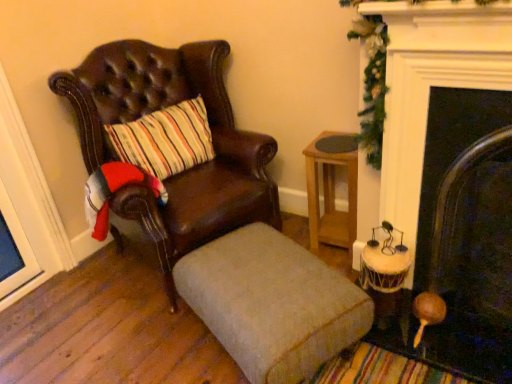
This screenshot has width=512, height=384. What are the coordinates of `beige fabric ottoman at center` in the screenshot? It's located at pyautogui.click(x=272, y=303).

Identify the location of leather chair at left. (181, 173).

From the picture: In order to face light brown wooden table at center-right, should I rotate leftwards or rightwards?

Rotate right and turn 11.432 degrees.

Where is `dark wood fireplace at right`? The width and height of the screenshot is (512, 384). dark wood fireplace at right is located at coordinates (469, 233).

I want to click on beige fabric ottoman at center, so click(x=272, y=303).

Is leather chair at left positioned in front of green garland at upper right?

No, leather chair at left is further to the viewer.

How many degrees apart are the facing directions of leather chair at left and green garland at upper right?

leather chair at left and green garland at upper right are facing 70.1 degrees away from each other.

Is leather chair at left with green garland at upper right?

No, leather chair at left is not beside green garland at upper right.

Is leather chair at left smaller than green garland at upper right?

No, leather chair at left is not smaller than green garland at upper right.

What's the angular difference between dark wood fireplace at right and green garland at upper right's facing directions?

There is a 1.19-degree angle between the facing directions of dark wood fireplace at right and green garland at upper right.

Does point (429, 186) come farther from viewer compared to point (367, 19)?

Yes, it is.

Is dark wood fireplace at right to the left of green garland at upper right from the viewer's perspective?

Incorrect, dark wood fireplace at right is not on the left side of green garland at upper right.

From a real-world perspective, who is located higher, dark wood fireplace at right or green garland at upper right?

green garland at upper right is physically above.

Is point (330, 300) positioned in front of point (102, 51)?

Yes, it is in front of point (102, 51).

Are beige fabric ottoman at center and leather chair at left making contact?

No, beige fabric ottoman at center is not in contact with leather chair at left.

Is dark wood fireplace at right located outside beige fabric ottoman at center?

Yes, dark wood fireplace at right is not within beige fabric ottoman at center.

In terms of size, does dark wood fireplace at right appear bigger or smaller than beige fabric ottoman at center?

dark wood fireplace at right is smaller than beige fabric ottoman at center.

From a real-world perspective, who is located lower, dark wood fireplace at right or beige fabric ottoman at center?

beige fabric ottoman at center.

In the image, there is a dark wood fireplace at right. At what (x,y) coordinates should I click in order to perform the action: click on the footrest below it (from the image's perspective). Please return your answer as a coordinate pair (x, y). Looking at the image, I should click on (272, 303).

Which of these two, light brown wooden table at center-right or green garland at upper right, is wider?

With larger width is light brown wooden table at center-right.

Can you confirm if light brown wooden table at center-right is shorter than green garland at upper right?

Correct, light brown wooden table at center-right is not as tall as green garland at upper right.

How much distance is there between light brown wooden table at center-right and green garland at upper right?

light brown wooden table at center-right is 17.04 inches away from green garland at upper right.

Is the depth of light brown wooden table at center-right greater than that of leather chair at left?

Yes.

In the image, there is a light brown wooden table at center-right. Where is `chair above it (from the image's perspective)`? chair above it (from the image's perspective) is located at coordinates (181, 173).

Considering the relative sizes of light brown wooden table at center-right and leather chair at left in the image provided, is light brown wooden table at center-right wider than leather chair at left?

Incorrect, the width of light brown wooden table at center-right does not surpass that of leather chair at left.

Who is more distant, dark wood fireplace at right or leather chair at left?

Positioned behind is leather chair at left.

Is dark wood fireplace at right not within leather chair at left?

Yes, dark wood fireplace at right is not within leather chair at left.

This screenshot has height=384, width=512. I want to click on chair beneath the green garland at upper right (from a real-world perspective), so click(x=181, y=173).

Identify the location of fireplace that appears in front of the green garland at upper right. This screenshot has width=512, height=384. (469, 233).

Estimate the real-world distances between objects in this image. Which object is further from light brown wooden table at center-right, leather chair at left or beige fabric ottoman at center?

beige fabric ottoman at center is positioned further to the anchor light brown wooden table at center-right.

Looking at the image, which one is located closer to beige fabric ottoman at center, leather chair at left or dark wood fireplace at right?

leather chair at left lies closer to beige fabric ottoman at center than the other object.

Based on their spatial positions, is dark wood fireplace at right or green garland at upper right closer to beige fabric ottoman at center?

The object closer to beige fabric ottoman at center is dark wood fireplace at right.

When comparing their distances from green garland at upper right, does light brown wooden table at center-right or beige fabric ottoman at center seem further?

beige fabric ottoman at center lies further to green garland at upper right than the other object.

Looking at the image, which one is located further to light brown wooden table at center-right, beige fabric ottoman at center or dark wood fireplace at right?

The object further to light brown wooden table at center-right is beige fabric ottoman at center.

Estimate the real-world distances between objects in this image. Which object is closer to beige fabric ottoman at center, green garland at upper right or dark wood fireplace at right?

Based on the image, dark wood fireplace at right appears to be nearer to beige fabric ottoman at center.

Which object lies further to the anchor point leather chair at left, green garland at upper right or dark wood fireplace at right?

The object further to leather chair at left is dark wood fireplace at right.

Which object lies further to the anchor point beige fabric ottoman at center, leather chair at left or light brown wooden table at center-right?

light brown wooden table at center-right lies further to beige fabric ottoman at center than the other object.

Locate an element on the screen. The width and height of the screenshot is (512, 384). christmas decoration positioned between dark wood fireplace at right and light brown wooden table at center-right from near to far is located at coordinates (372, 85).

Where is `christmas decoration between leather chair at left and light brown wooden table at center-right in the horizontal direction`? Image resolution: width=512 pixels, height=384 pixels. christmas decoration between leather chair at left and light brown wooden table at center-right in the horizontal direction is located at coordinates (372, 85).

At what (x,y) coordinates should I click in order to perform the action: click on the footrest located between leather chair at left and light brown wooden table at center-right in the left-right direction. Please return your answer as a coordinate pair (x, y). This screenshot has height=384, width=512. Looking at the image, I should click on (272, 303).

I want to click on fireplace between green garland at upper right and beige fabric ottoman at center in the up-down direction, so 469,233.